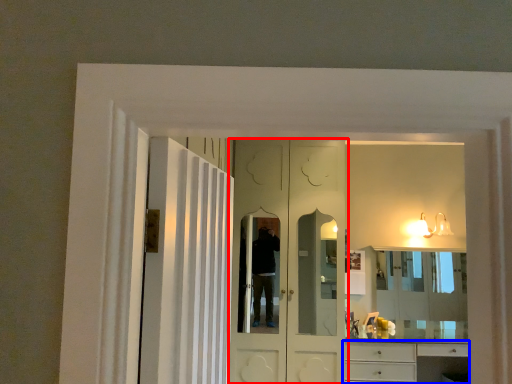
Question: Which object is further to the camera taking this photo, door (highlighted by a red box) or cabinetry (highlighted by a blue box)?

Choices:
 (A) door
 (B) cabinetry

Answer: (B)